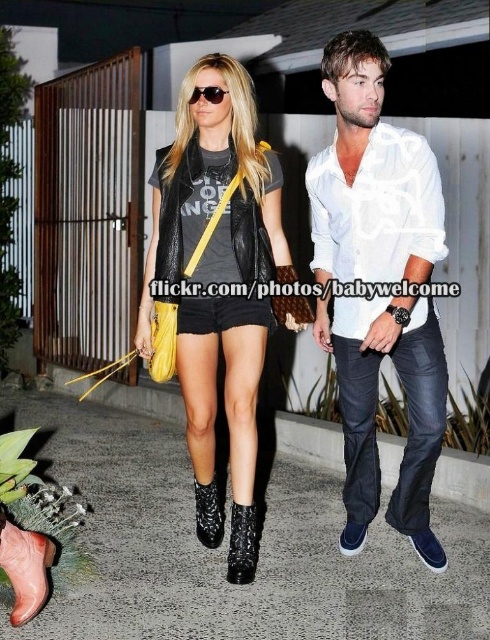
Can you confirm if black leather vest at center is taller than leather boot at lower left?

Indeed, black leather vest at center has a greater height compared to leather boot at lower left.

Does black leather vest at center appear on the left side of leather boot at lower left?

No, black leather vest at center is not to the left of leather boot at lower left.

Is point (270, 248) less distant than point (27, 577)?

No, it is not.

Identify the location of black leather vest at center. The width and height of the screenshot is (490, 640). (213, 193).

Between white cotton shirt at upper right and black leather boot at lower center, which one is positioned lower?

black leather boot at lower center

What do you see at coordinates (376, 209) in the screenshot? The width and height of the screenshot is (490, 640). I see `white cotton shirt at upper right` at bounding box center [376, 209].

I want to click on white cotton shirt at upper right, so click(x=376, y=209).

Is black leather vest at center further to the viewer compared to white cotton shirt at upper right?

Yes, black leather vest at center is behind white cotton shirt at upper right.

Is black leather vest at center closer to camera compared to white cotton shirt at upper right?

No, black leather vest at center is behind white cotton shirt at upper right.

Is point (189, 252) positioned behind point (335, 157)?

Yes, point (189, 252) is behind point (335, 157).

Identify the location of black leather vest at center. [x=213, y=193].